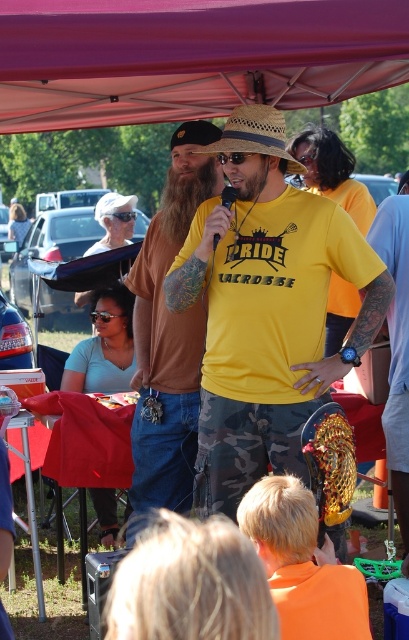
Question: Does pink fabric canopy at upper center appear on the left side of yellow matte t-shirt at center?

Choices:
 (A) no
 (B) yes

Answer: (A)

Question: Which object is closer to the camera taking this photo?

Choices:
 (A) yellow matte shirt at center
 (B) yellow matte t-shirt at center
 (C) strawhat at center
 (D) beardsoft/hair-likeat center

Answer: (C)

Question: Considering the real-world distances, which object is farthest from the brownwoodybeard at center?

Choices:
 (A) pink fabric canopy at upper center
 (B) strawhat at center

Answer: (A)

Question: Considering the real-world distances, which object is closest to the yellow matte shirt at center?

Choices:
 (A) beardsoft/hair-likeat center
 (B) pink fabric canopy at upper center
 (C) strawhat at center
 (D) black matte microphone at center

Answer: (A)

Question: Observing the image, what is the correct spatial positioning of yellow matte shirt at center in reference to yellow matte t-shirt at center?

Choices:
 (A) left
 (B) right

Answer: (B)

Question: Is strawhat at center bigger than beardsoft/hair-likeat center?

Choices:
 (A) no
 (B) yes

Answer: (B)